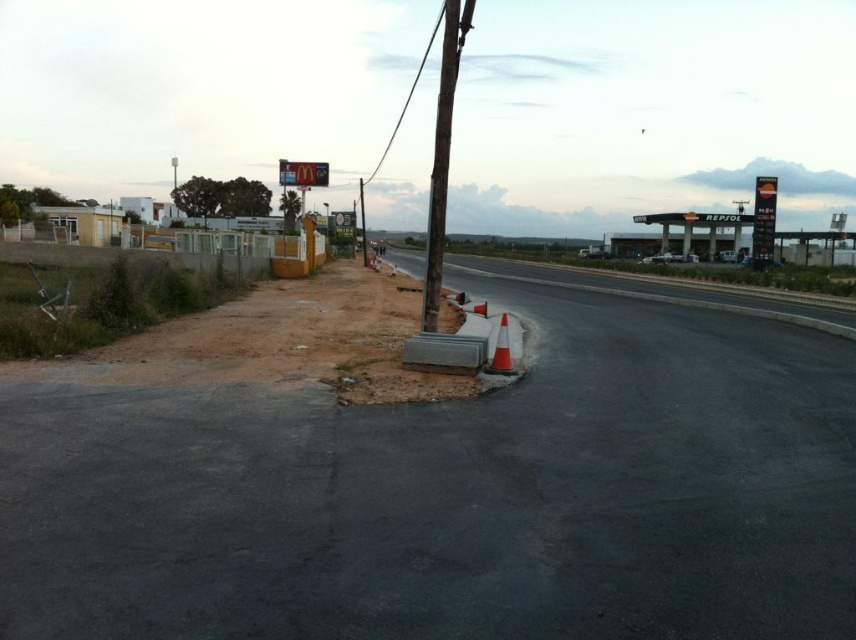
Is brown wooden pole at center behind smooth concrete pole at center?

No.

Does point (447, 97) lie in front of point (361, 204)?

Yes.

Identify the location of brown wooden pole at center. This screenshot has height=640, width=856. (440, 166).

Who is positioned more to the left, black asphalt highway at center or smooth concrete pole at center?

smooth concrete pole at center

The image size is (856, 640). What do you see at coordinates (453, 496) in the screenshot? I see `black asphalt highway at center` at bounding box center [453, 496].

Locate an element on the screen. This screenshot has height=640, width=856. black asphalt highway at center is located at coordinates (453, 496).

Identify the location of black asphalt highway at center. (453, 496).

The image size is (856, 640). I want to click on black asphalt highway at center, so click(453, 496).